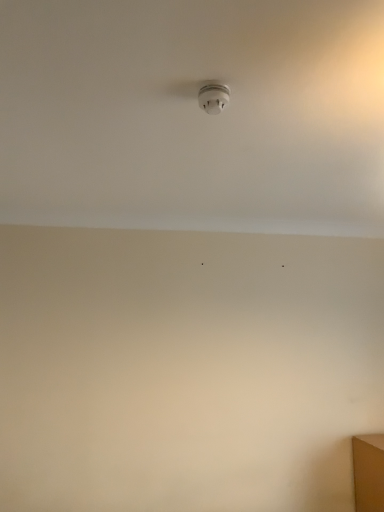
Question: Can you confirm if white plastic smoke detector at upper center is bigger than white matte ceiling at center?

Choices:
 (A) no
 (B) yes

Answer: (A)

Question: Is white plastic smoke detector at upper center oriented away from white matte ceiling at center?

Choices:
 (A) no
 (B) yes

Answer: (A)

Question: Is white plastic smoke detector at upper center not near white matte ceiling at center?

Choices:
 (A) no
 (B) yes

Answer: (A)

Question: Is the depth of white plastic smoke detector at upper center less than that of white matte ceiling at center?

Choices:
 (A) yes
 (B) no

Answer: (B)

Question: Can you confirm if white plastic smoke detector at upper center is smaller than white matte ceiling at center?

Choices:
 (A) no
 (B) yes

Answer: (B)

Question: Is white plastic smoke detector at upper center surrounding white matte ceiling at center?

Choices:
 (A) yes
 (B) no

Answer: (B)

Question: Can you confirm if white matte ceiling at center is positioned to the right of white plastic smoke detector at upper center?

Choices:
 (A) no
 (B) yes

Answer: (B)

Question: Considering the relative sizes of white matte ceiling at center and white plastic smoke detector at upper center in the image provided, is white matte ceiling at center smaller than white plastic smoke detector at upper center?

Choices:
 (A) yes
 (B) no

Answer: (B)

Question: Is white matte ceiling at center closer to camera compared to white plastic smoke detector at upper center?

Choices:
 (A) no
 (B) yes

Answer: (B)

Question: From the image's perspective, does white matte ceiling at center appear lower than white plastic smoke detector at upper center?

Choices:
 (A) yes
 (B) no

Answer: (A)

Question: Considering the relative sizes of white matte ceiling at center and white plastic smoke detector at upper center in the image provided, is white matte ceiling at center bigger than white plastic smoke detector at upper center?

Choices:
 (A) no
 (B) yes

Answer: (B)

Question: Considering the relative positions of white matte ceiling at center and white plastic smoke detector at upper center in the image provided, is white matte ceiling at center behind white plastic smoke detector at upper center?

Choices:
 (A) yes
 (B) no

Answer: (B)

Question: Choose the correct answer: Is white matte ceiling at center inside white plastic smoke detector at upper center or outside it?

Choices:
 (A) outside
 (B) inside

Answer: (A)